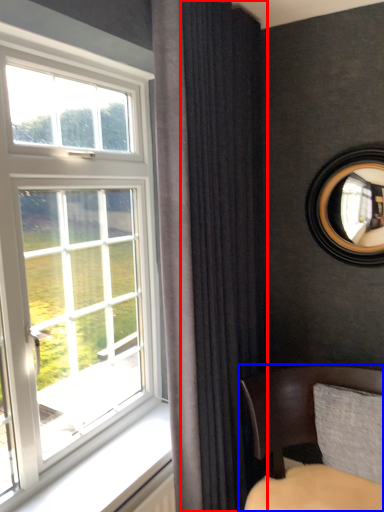
Question: Which object appears farthest to the camera in this image, curtain (highlighted by a red box) or chair (highlighted by a blue box)?

Choices:
 (A) curtain
 (B) chair

Answer: (A)